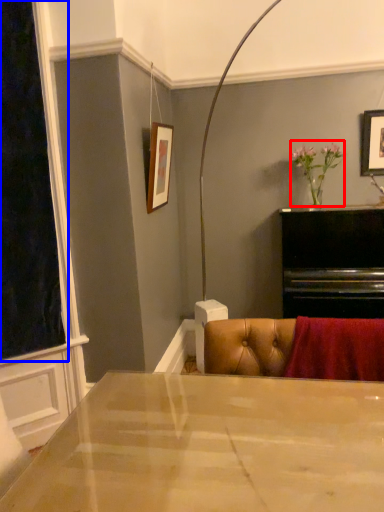
Question: Which point is closer to the camera, floral arrangement (highlighted by a red box) or window screen (highlighted by a blue box)?

Choices:
 (A) floral arrangement
 (B) window screen

Answer: (B)